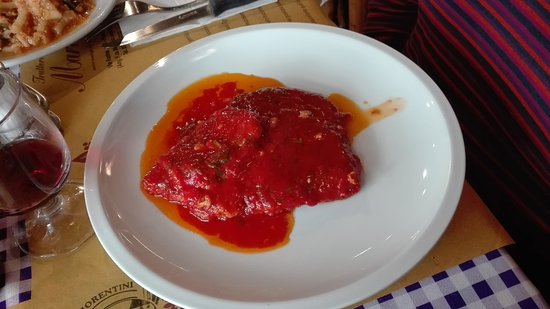
You are a GUI agent. You are given a task and a screenshot of the screen. Output one action in this format:
    pyautogui.click(x=<x>, y=<y>)
    Task: Click on the checkerboard tablecloth
    
    Given the screenshot: What is the action you would take?
    pyautogui.click(x=458, y=287), pyautogui.click(x=19, y=278), pyautogui.click(x=22, y=238), pyautogui.click(x=15, y=69)